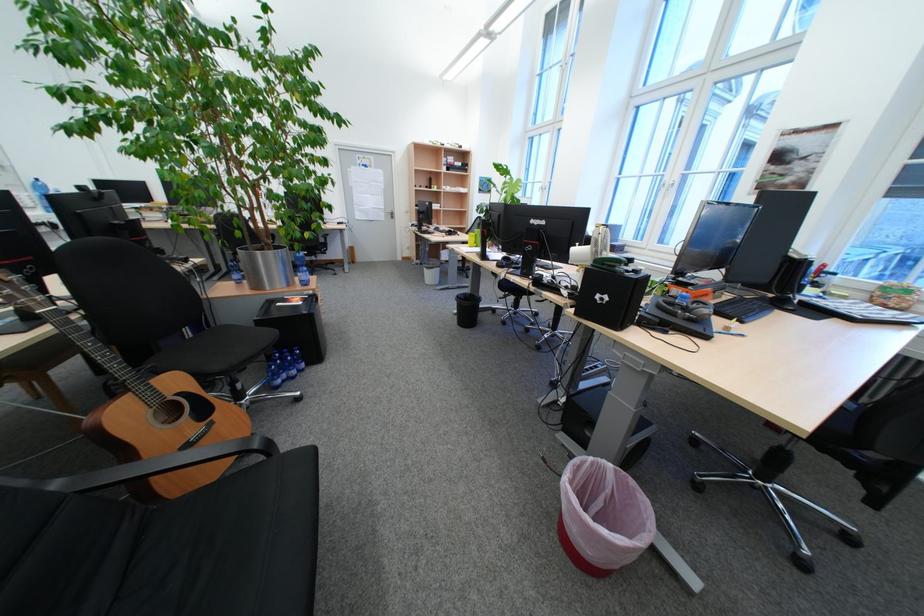
The width and height of the screenshot is (924, 616). What do you see at coordinates (554, 280) in the screenshot?
I see `a gray headphones` at bounding box center [554, 280].